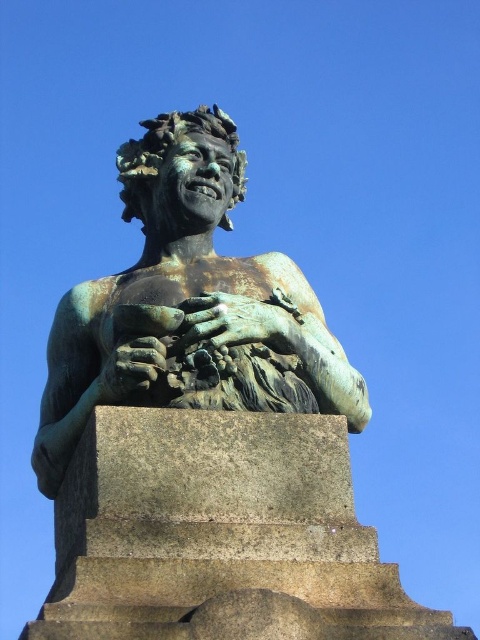
You are a maintenance worker inspecting the statue. You notice a specific point at coordinates (189, 298). What object is located at that point?

The green patina bronze statue at center is located at point (189, 298).